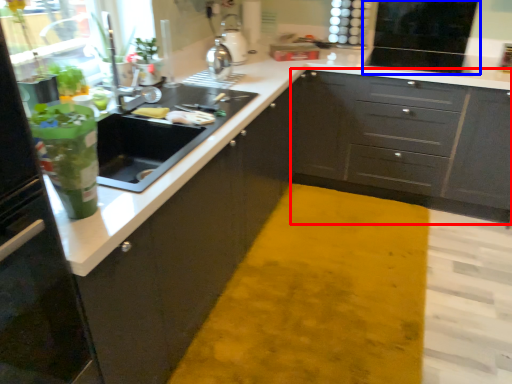
Question: Which object is closer to the camera taking this photo, cabinetry (highlighted by a red box) or appliance (highlighted by a blue box)?

Choices:
 (A) cabinetry
 (B) appliance

Answer: (A)